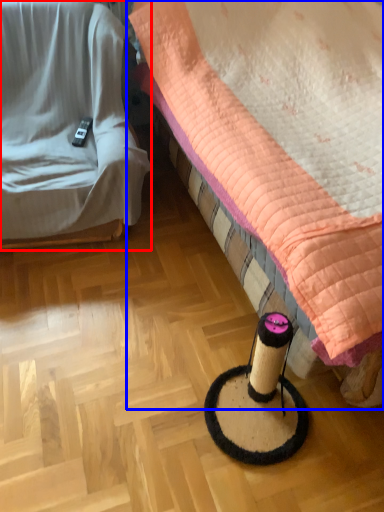
Question: Which object is closer to the camera taking this photo, furniture (highlighted by a red box) or bed (highlighted by a blue box)?

Choices:
 (A) furniture
 (B) bed

Answer: (B)